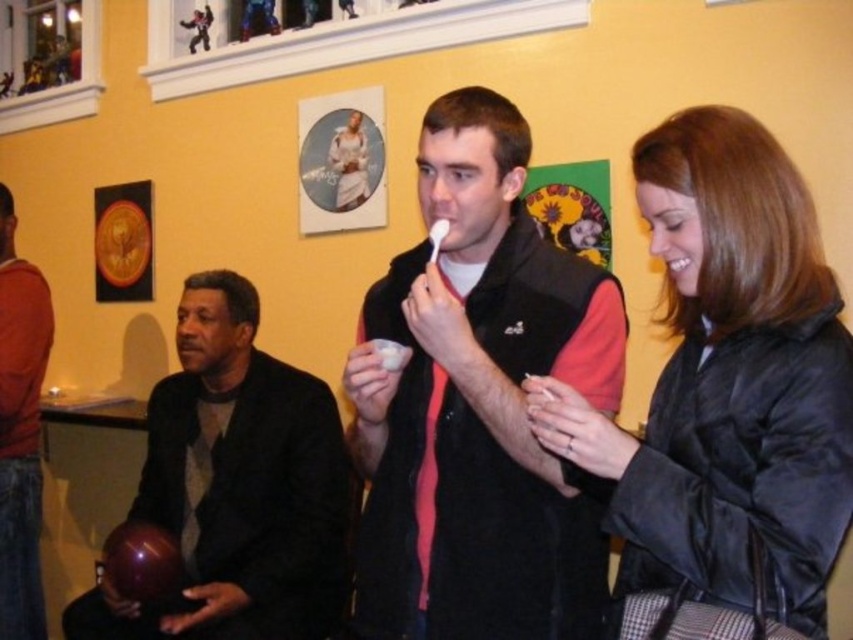
Looking at this image, is black puffy jacket at center shorter than shiny black bowling ball at left?

Yes.

At what (x,y) coordinates should I click in order to perform the action: click on black puffy jacket at center. Please return your answer as a coordinate pair (x, y). Looking at the image, I should click on (724, 400).

Where is `black puffy jacket at center`? This screenshot has height=640, width=853. black puffy jacket at center is located at coordinates (724, 400).

Is shiny black bowling ball at left bigger than orange cotton shirt at left?

Correct, shiny black bowling ball at left is larger in size than orange cotton shirt at left.

Is shiny black bowling ball at left above orange cotton shirt at left?

No, shiny black bowling ball at left is not above orange cotton shirt at left.

Which is behind, point (194, 356) or point (24, 272)?

Point (24, 272)

This screenshot has height=640, width=853. Find the location of `shiny black bowling ball at left`. shiny black bowling ball at left is located at coordinates (236, 484).

Is black matte vest at center taller than orange cotton shirt at left?

Incorrect, black matte vest at center's height is not larger of orange cotton shirt at left's.

Between point (506, 522) and point (4, 358), which one is positioned behind?

Positioned behind is point (4, 358).

Is point (514, 616) less distant than point (1, 435)?

That is True.

Identify the location of black matte vest at center. (479, 404).